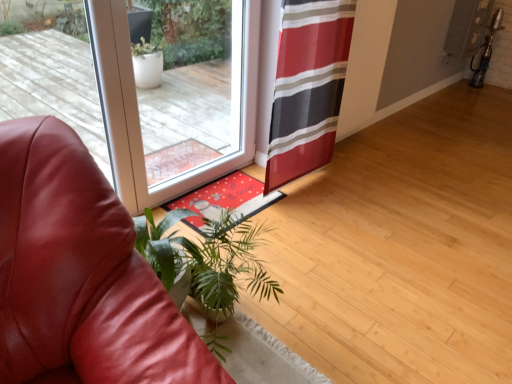
Question: From a real-world perspective, is red and black striped curtain at center physically below leather couch at lower left?

Choices:
 (A) no
 (B) yes

Answer: (A)

Question: Can you confirm if red and black striped curtain at center is taller than leather couch at lower left?

Choices:
 (A) yes
 (B) no

Answer: (A)

Question: Is the position of red and black striped curtain at center more distant than that of leather couch at lower left?

Choices:
 (A) no
 (B) yes

Answer: (B)

Question: From a real-world perspective, is red and black striped curtain at center positioned over leather couch at lower left based on gravity?

Choices:
 (A) no
 (B) yes

Answer: (B)

Question: Does red and black striped curtain at center have a lesser height compared to leather couch at lower left?

Choices:
 (A) no
 (B) yes

Answer: (A)

Question: From a real-world perspective, relative to leather couch at lower left, is red and black striped curtain at center vertically above or below?

Choices:
 (A) above
 (B) below

Answer: (A)

Question: In the image, is red and black striped curtain at center positioned in front of or behind leather couch at lower left?

Choices:
 (A) front
 (B) behind

Answer: (B)

Question: From their relative heights in the image, would you say red and black striped curtain at center is taller or shorter than leather couch at lower left?

Choices:
 (A) short
 (B) tall

Answer: (B)

Question: Does point (298, 72) appear closer or farther from the camera than point (113, 288)?

Choices:
 (A) closer
 (B) farther

Answer: (B)

Question: Is green leafy plant at lower left wider or thinner than red and black striped curtain at center?

Choices:
 (A) thin
 (B) wide

Answer: (B)

Question: Do you think green leafy plant at lower left is within red and black striped curtain at center, or outside of it?

Choices:
 (A) outside
 (B) inside

Answer: (A)

Question: In the image, is green leafy plant at lower left on the left side or the right side of red and black striped curtain at center?

Choices:
 (A) left
 (B) right

Answer: (A)

Question: From a real-world perspective, is green leafy plant at lower left positioned above or below red and black striped curtain at center?

Choices:
 (A) below
 (B) above

Answer: (A)

Question: In terms of width, does transparent glass door at center look wider or thinner when compared to green leafy plant at lower left?

Choices:
 (A) thin
 (B) wide

Answer: (A)

Question: From a real-world perspective, relative to green leafy plant at lower left, is transparent glass door at center vertically above or below?

Choices:
 (A) below
 (B) above

Answer: (B)